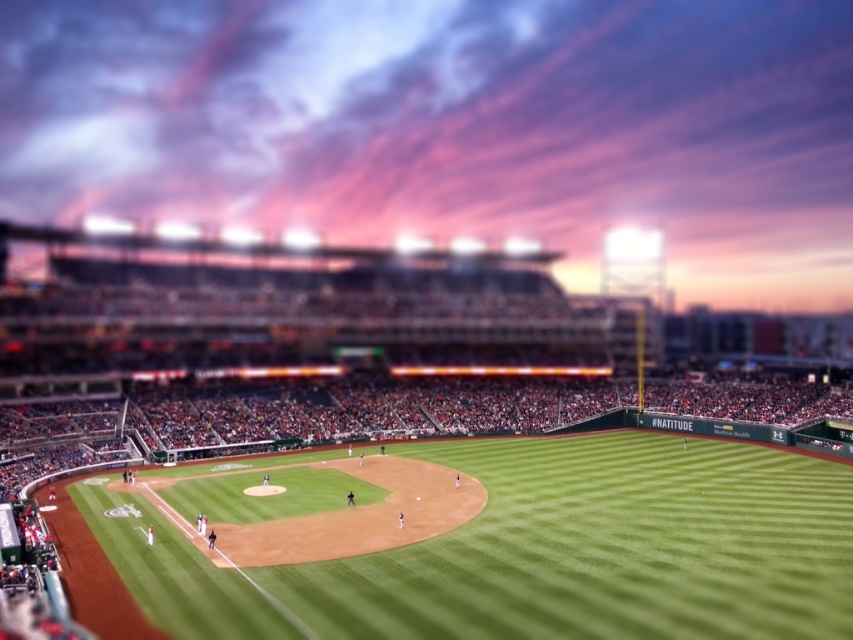
You are a drone operator tasked with capturing aerial footage of the green grass baseball stadium at center and the green grass field at center. Which of the two areas should you focus your camera on to ensure the tallest structure is properly highlighted in your video?

The green grass baseball stadium at center is much taller than the green grass field at center, so you should focus your camera on the green grass baseball stadium at center to highlight its height.

You are a groundskeeper at the baseball stadium and need to mow the green grass baseball stadium at center and the green grass field at center. Which area requires a wider mower to handle its width?

The green grass baseball stadium at center requires a wider mower because its width surpasses that of the green grass field at center.